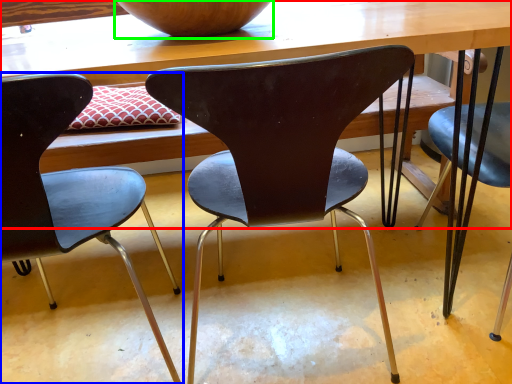
Question: Which object is positioned farthest from table (highlighted by a red box)? Select from chair (highlighted by a blue box) and bowl (highlighted by a green box).

Choices:
 (A) chair
 (B) bowl

Answer: (A)